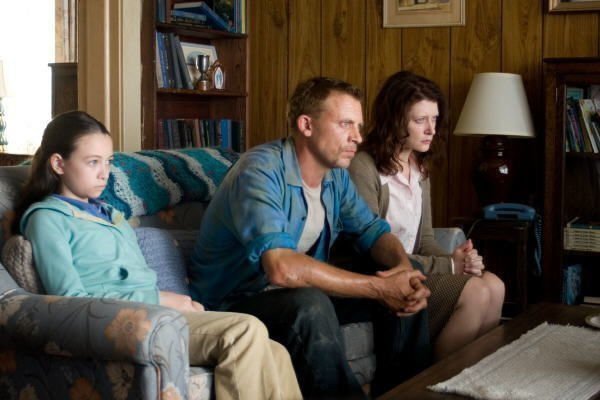
I want to click on flowered sofa, so click(115, 340).